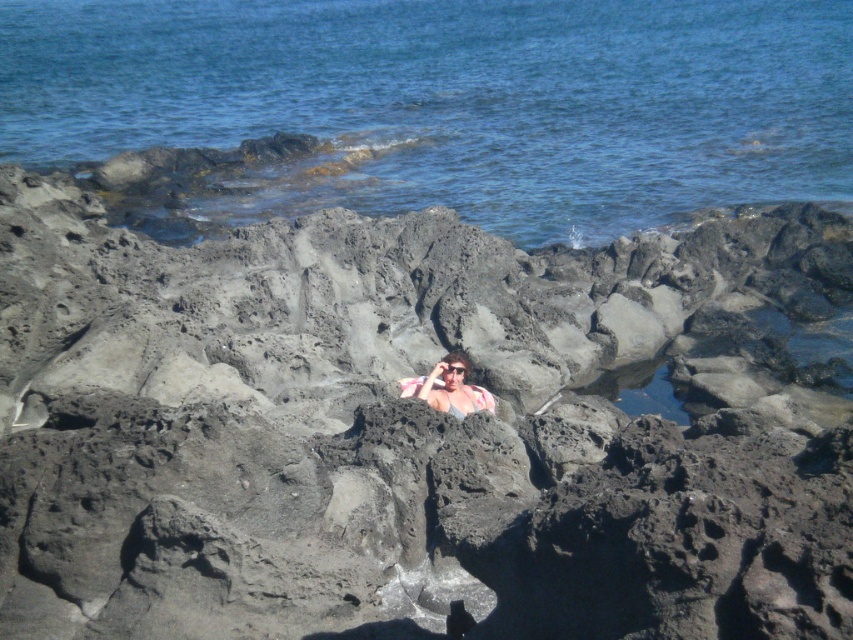
Question: Is black rough rock at center closer to the viewer compared to blue water at center?

Choices:
 (A) yes
 (B) no

Answer: (A)

Question: Which of these objects is positioned farthest from the black rough rock at center?

Choices:
 (A) blue water at center
 (B) pink fabric at center

Answer: (A)

Question: Does black rough rock at center have a greater width compared to pink fabric at center?

Choices:
 (A) no
 (B) yes

Answer: (A)

Question: Does black rough rock at center have a lesser width compared to blue water at center?

Choices:
 (A) no
 (B) yes

Answer: (B)

Question: Among these points, which one is nearest to the camera?

Choices:
 (A) (334, 74)
 (B) (646, 506)

Answer: (B)

Question: Which point is farther to the camera?

Choices:
 (A) (445, 404)
 (B) (67, 106)
 (C) (78, 209)

Answer: (B)